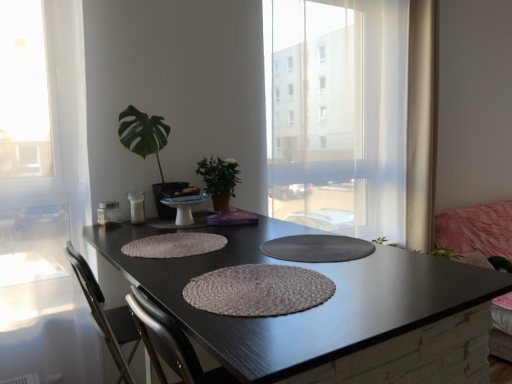
Question: Which direction should I rotate to look at rustic woven placemat at center, placed as the first wide when sorted from back to front, — up or down?

Choices:
 (A) down
 (B) up

Answer: (A)

Question: Is rustic woven placemat at center, which is the second wide from back to front, oriented towards shiny black table at center?

Choices:
 (A) yes
 (B) no

Answer: (A)

Question: Does rustic woven placemat at center, the 1th wide in the front-to-back sequence, have a lesser width compared to shiny black table at center?

Choices:
 (A) yes
 (B) no

Answer: (A)

Question: Considering the relative sizes of rustic woven placemat at center, which is the second wide from back to front, and shiny black table at center in the image provided, is rustic woven placemat at center, which is the second wide from back to front, bigger than shiny black table at center?

Choices:
 (A) no
 (B) yes

Answer: (A)

Question: Is rustic woven placemat at center, which is the second wide from back to front, touching shiny black table at center?

Choices:
 (A) no
 (B) yes

Answer: (A)

Question: From a real-world perspective, is rustic woven placemat at center, which is the second wide from back to front, located higher than shiny black table at center?

Choices:
 (A) yes
 (B) no

Answer: (A)

Question: Can you confirm if rustic woven placemat at center, which is the second wide from back to front, is taller than shiny black table at center?

Choices:
 (A) no
 (B) yes

Answer: (A)

Question: Is the position of rustic woven placemat at center, placed as the first wide when sorted from back to front, less distant than that of green matte plant at center, the second houseplant viewed from the left?

Choices:
 (A) yes
 (B) no

Answer: (A)

Question: Does rustic woven placemat at center, placed as the first wide when sorted from back to front, have a larger size compared to green matte plant at center, which is the first houseplant in right-to-left order?

Choices:
 (A) no
 (B) yes

Answer: (A)

Question: Does rustic woven placemat at center, placed as the first wide when sorted from back to front, turn towards green matte plant at center, the second houseplant viewed from the left?

Choices:
 (A) no
 (B) yes

Answer: (A)

Question: From the image's perspective, would you say rustic woven placemat at center, placed as the first wide when sorted from back to front, is shown under green matte plant at center, which is the first houseplant in right-to-left order?

Choices:
 (A) no
 (B) yes

Answer: (B)

Question: Is rustic woven placemat at center, which is the second wide in front-to-back order, behind green matte plant at center, which is the first houseplant in right-to-left order?

Choices:
 (A) no
 (B) yes

Answer: (A)

Question: Is rustic woven placemat at center, which is the second wide in front-to-back order, next to green matte plant at center, which is the first houseplant in right-to-left order?

Choices:
 (A) no
 (B) yes

Answer: (A)

Question: Is white sheer curtain at right not inside green glossy leafy plant at upper left, the 2th houseplant positioned from the right?

Choices:
 (A) no
 (B) yes

Answer: (B)